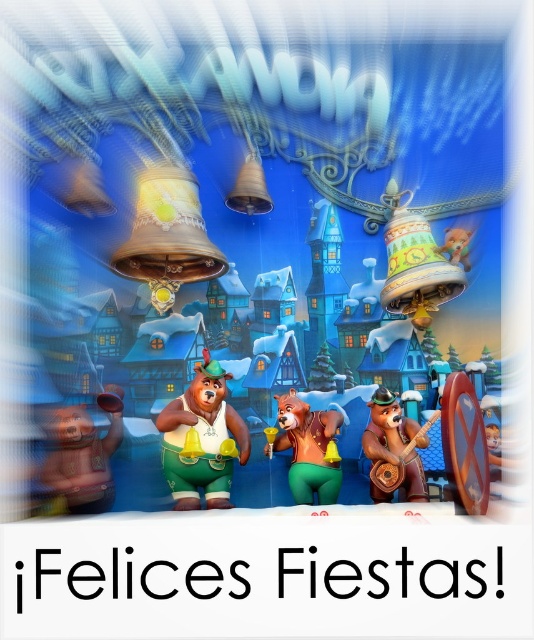
Question: Among these objects, which one is nearest to the camera?

Choices:
 (A) shiny gold bear at center
 (B) green matte bear at center
 (C) matte gold bear at lower left
 (D) wooden guitar at center

Answer: (C)

Question: Does matte gold bear at lower left appear over shiny gold bear at center?

Choices:
 (A) yes
 (B) no

Answer: (A)

Question: Which point appears farthest from the camera in this image?

Choices:
 (A) (363, 451)
 (B) (73, 456)
 (C) (230, 412)

Answer: (A)

Question: Can you confirm if matte gold bear at lower left is smaller than shiny gold bear at center?

Choices:
 (A) yes
 (B) no

Answer: (B)

Question: Does matte gold bear at lower left have a greater width compared to wooden guitar at center?

Choices:
 (A) no
 (B) yes

Answer: (B)

Question: Which object is the closest to the green matte bear at center?

Choices:
 (A) shiny gold bear at center
 (B) matte gold bear at lower left
 (C) wooden guitar at center

Answer: (A)